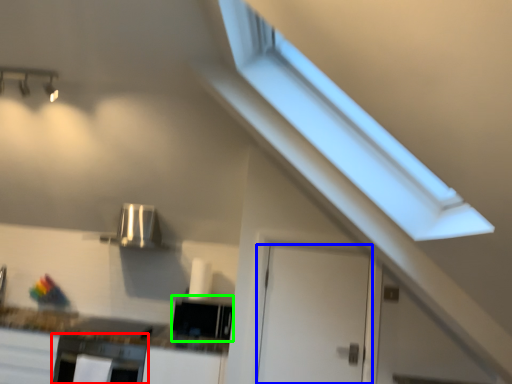
Question: Based on their relative distances, which object is nearer to oven (highlighted by a red box)? Choose from door (highlighted by a blue box) and appliance (highlighted by a green box).

Choices:
 (A) door
 (B) appliance

Answer: (B)